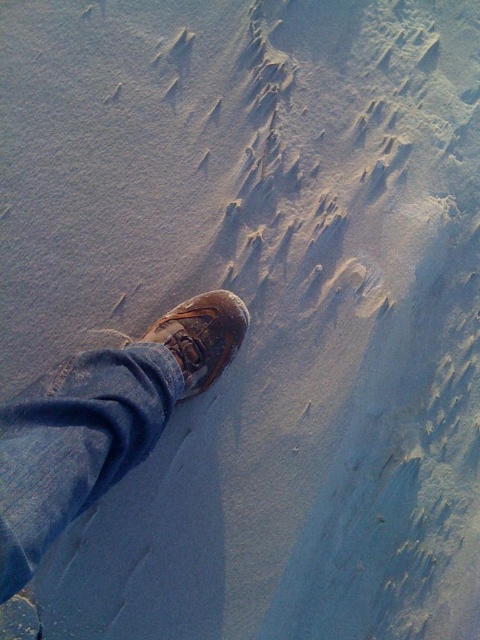
Question: Is brown leather shoe at center to the left of brown leather shoe at lower left from the viewer's perspective?

Choices:
 (A) no
 (B) yes

Answer: (B)

Question: Which of the following is the closest to the observer?

Choices:
 (A) (159, 390)
 (B) (238, 333)

Answer: (A)

Question: Does brown leather shoe at center have a smaller size compared to brown leather shoe at lower left?

Choices:
 (A) yes
 (B) no

Answer: (B)

Question: Considering the relative positions of brown leather shoe at center and brown leather shoe at lower left in the image provided, where is brown leather shoe at center located with respect to brown leather shoe at lower left?

Choices:
 (A) left
 (B) right

Answer: (A)

Question: Which object is closer to the camera taking this photo?

Choices:
 (A) brown leather shoe at lower left
 (B) brown leather shoe at center

Answer: (B)